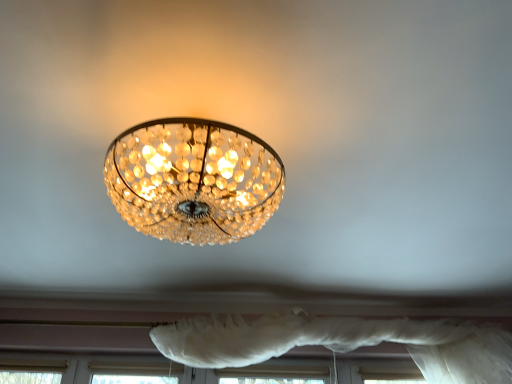
Describe the element at coordinates (342, 342) in the screenshot. I see `white sheer curtain at lower center` at that location.

Find the location of a particular element. This screenshot has width=512, height=384. white sheer curtain at lower center is located at coordinates (342, 342).

Where is `translucent crystal chandelier at upper center`? The width and height of the screenshot is (512, 384). translucent crystal chandelier at upper center is located at coordinates (193, 180).

Image resolution: width=512 pixels, height=384 pixels. Describe the element at coordinates (193, 180) in the screenshot. I see `translucent crystal chandelier at upper center` at that location.

The height and width of the screenshot is (384, 512). I want to click on white sheer curtain at lower center, so click(342, 342).

Which is more to the right, translucent crystal chandelier at upper center or white sheer curtain at lower center?

From the viewer's perspective, white sheer curtain at lower center appears more on the right side.

Is translucent crystal chandelier at upper center closer to the viewer compared to white sheer curtain at lower center?

Yes.

Which point is more forward, (x=193, y=231) or (x=319, y=336)?

The point (x=193, y=231) is in front.

From the image's perspective, is translucent crystal chandelier at upper center on top of white sheer curtain at lower center?

Yes.

From a real-world perspective, which object rests below the other?

white sheer curtain at lower center is physically lower.

Can you confirm if translucent crystal chandelier at upper center is thinner than white sheer curtain at lower center?

No.

Considering the sizes of objects translucent crystal chandelier at upper center and white sheer curtain at lower center in the image provided, who is shorter, translucent crystal chandelier at upper center or white sheer curtain at lower center?

With less height is translucent crystal chandelier at upper center.

Can you confirm if translucent crystal chandelier at upper center is smaller than white sheer curtain at lower center?

Yes.

Can we say translucent crystal chandelier at upper center lies outside white sheer curtain at lower center?

Absolutely, translucent crystal chandelier at upper center is external to white sheer curtain at lower center.

Is translucent crystal chandelier at upper center placed right next to white sheer curtain at lower center?

No, translucent crystal chandelier at upper center is not with white sheer curtain at lower center.

Is translucent crystal chandelier at upper center turned away from white sheer curtain at lower center?

Yes, translucent crystal chandelier at upper center is positioned with its back facing white sheer curtain at lower center.

I want to click on curtain lying below the translucent crystal chandelier at upper center (from the image's perspective), so click(342, 342).

Between white sheer curtain at lower center and translucent crystal chandelier at upper center, which one appears on the right side from the viewer's perspective?

Positioned to the right is white sheer curtain at lower center.

Considering the positions of objects white sheer curtain at lower center and translucent crystal chandelier at upper center in the image provided, who is in front, white sheer curtain at lower center or translucent crystal chandelier at upper center?

translucent crystal chandelier at upper center is closer to the camera.

Which is closer to the camera, (244, 347) or (205, 124)?

Point (244, 347) is positioned farther from the camera compared to point (205, 124).

From the image's perspective, does white sheer curtain at lower center appear higher than translucent crystal chandelier at upper center?

No, from the image's perspective, white sheer curtain at lower center is not on top of translucent crystal chandelier at upper center.

From a real-world perspective, is white sheer curtain at lower center positioned above or below translucent crystal chandelier at upper center?

white sheer curtain at lower center is situated lower than translucent crystal chandelier at upper center in the real world.

Considering the sizes of white sheer curtain at lower center and translucent crystal chandelier at upper center in the image, is white sheer curtain at lower center wider or thinner than translucent crystal chandelier at upper center?

Considering their sizes, white sheer curtain at lower center looks slimmer than translucent crystal chandelier at upper center.

Considering the sizes of objects white sheer curtain at lower center and translucent crystal chandelier at upper center in the image provided, who is shorter, white sheer curtain at lower center or translucent crystal chandelier at upper center?

With less height is translucent crystal chandelier at upper center.

Does white sheer curtain at lower center have a smaller size compared to translucent crystal chandelier at upper center?

Incorrect, white sheer curtain at lower center is not smaller in size than translucent crystal chandelier at upper center.

In the scene shown: Would you say white sheer curtain at lower center is outside translucent crystal chandelier at upper center?

white sheer curtain at lower center lies outside translucent crystal chandelier at upper center's area.

Is white sheer curtain at lower center far away from translucent crystal chandelier at upper center?

Yes.

Does white sheer curtain at lower center turn towards translucent crystal chandelier at upper center?

Yes.

What's the angular difference between white sheer curtain at lower center and translucent crystal chandelier at upper center's facing directions?

The angle between the facing direction of white sheer curtain at lower center and the facing direction of translucent crystal chandelier at upper center is 1.66 degrees.

Measure the distance from white sheer curtain at lower center to translucent crystal chandelier at upper center.

white sheer curtain at lower center and translucent crystal chandelier at upper center are 1.53 meters apart from each other.

In order to click on curtain that is under the translucent crystal chandelier at upper center (from a real-world perspective) in this screenshot , I will do (x=342, y=342).

You are a GUI agent. You are given a task and a screenshot of the screen. Output one action in this format:
    pyautogui.click(x=<x>, y=<y>)
    Task: Click on the lamp above the white sheer curtain at lower center (from the image's perspective)
    This screenshot has width=512, height=384.
    Given the screenshot: What is the action you would take?
    pyautogui.click(x=193, y=180)

The width and height of the screenshot is (512, 384). Find the location of `lamp above the white sheer curtain at lower center (from a real-world perspective)`. lamp above the white sheer curtain at lower center (from a real-world perspective) is located at coordinates (193, 180).